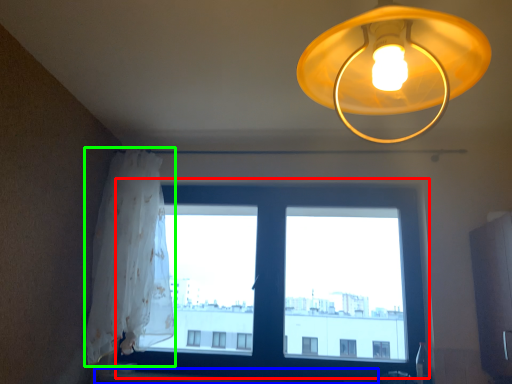
Question: Estimate the real-world distances between objects in this image. Which object is farther from window (highlighted by a red box), window sill (highlighted by a blue box) or curtain (highlighted by a green box)?

Choices:
 (A) window sill
 (B) curtain

Answer: (A)